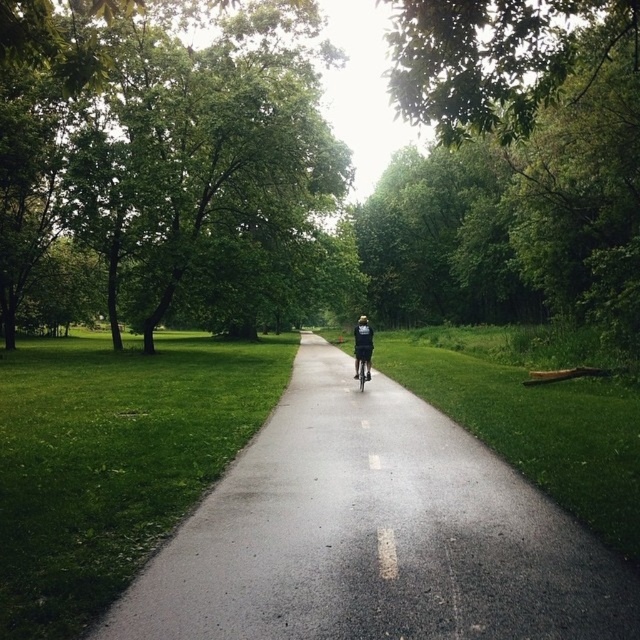
How far apart are black asphalt path at center and green leafy tree at center?

black asphalt path at center and green leafy tree at center are 11.00 meters apart.

Between point (291, 538) and point (412, 44), which one is positioned in front?

Positioned in front is point (291, 538).

Is point (275, 442) farther from viewer compared to point (490, 106)?

Yes, it is behind point (490, 106).

Locate an element on the screen. This screenshot has width=640, height=640. black asphalt path at center is located at coordinates 372,534.

Can you confirm if black fabric jacket at center is bigger than matte black bicycle at center?

Correct, black fabric jacket at center is larger in size than matte black bicycle at center.

This screenshot has width=640, height=640. What do you see at coordinates (362, 346) in the screenshot? I see `black fabric jacket at center` at bounding box center [362, 346].

At what (x,y) coordinates should I click in order to perform the action: click on black fabric jacket at center. Please return your answer as a coordinate pair (x, y). This screenshot has width=640, height=640. Looking at the image, I should click on (362, 346).

Measure the distance between green leafy tree at center and camera.

green leafy tree at center is 8.09 meters from camera.

Who is lower down, green leafy tree at center or black fabric jacket at center?

Positioned lower is black fabric jacket at center.

Between point (516, 116) and point (356, 356), which one is positioned behind?

Positioned behind is point (356, 356).

Where is `green leafy tree at center`? The width and height of the screenshot is (640, 640). green leafy tree at center is located at coordinates (541, 129).